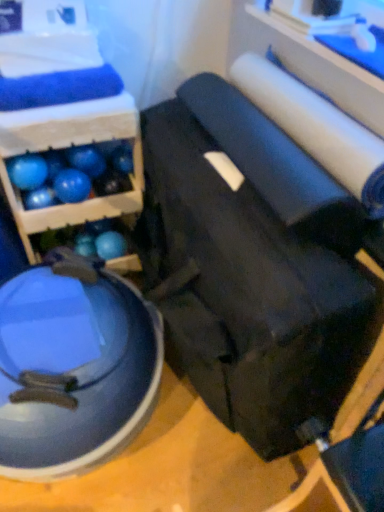
Question: Does blue matte wood shelf at upper left have a larger size compared to black leather swivel chair at center, positioned as the first swivel chair in right-to-left order?

Choices:
 (A) no
 (B) yes

Answer: (A)

Question: Does blue matte wood shelf at upper left have a lesser height compared to black leather swivel chair at center, acting as the 2th swivel chair starting from the left?

Choices:
 (A) no
 (B) yes

Answer: (B)

Question: Can you confirm if blue matte wood shelf at upper left is thinner than black leather swivel chair at center, positioned as the first swivel chair in right-to-left order?

Choices:
 (A) yes
 (B) no

Answer: (A)

Question: From a real-world perspective, is blue matte wood shelf at upper left located higher than black leather swivel chair at center, positioned as the first swivel chair in right-to-left order?

Choices:
 (A) no
 (B) yes

Answer: (B)

Question: Could you tell me if blue matte wood shelf at upper left is turned towards black leather swivel chair at center, positioned as the first swivel chair in right-to-left order?

Choices:
 (A) yes
 (B) no

Answer: (B)

Question: Is blue matte wood shelf at upper left next to black leather swivel chair at center, positioned as the first swivel chair in right-to-left order, and touching it?

Choices:
 (A) no
 (B) yes

Answer: (A)

Question: Is blue rubber ball at lower left, placed as the 4th ball when sorted from right to left, oriented away from blue rubber ball at center, acting as the 1th ball starting from the right?

Choices:
 (A) no
 (B) yes

Answer: (A)

Question: From a real-world perspective, is blue rubber ball at lower left, placed as the 4th ball when sorted from right to left, on blue rubber ball at center, which is the 5th ball in left-to-right order?

Choices:
 (A) yes
 (B) no

Answer: (B)

Question: Does blue rubber ball at lower left, placed as the 4th ball when sorted from right to left, have a larger size compared to blue rubber ball at center, acting as the 1th ball starting from the right?

Choices:
 (A) no
 (B) yes

Answer: (A)

Question: Could you tell me if blue rubber ball at lower left, the 2th ball when ordered from left to right, is turned towards blue rubber ball at center, acting as the 1th ball starting from the right?

Choices:
 (A) yes
 (B) no

Answer: (B)

Question: Is blue rubber ball at lower left, placed as the 4th ball when sorted from right to left, completely or partially outside of blue rubber ball at center, acting as the 1th ball starting from the right?

Choices:
 (A) yes
 (B) no

Answer: (A)

Question: Are blue rubber ball at lower left, the 2th ball when ordered from left to right, and blue rubber ball at center, acting as the 1th ball starting from the right, located far from each other?

Choices:
 (A) no
 (B) yes

Answer: (A)

Question: Is blue rubber ball at lower left, placed as the 4th ball when sorted from right to left, positioned behind glossy blue exercise ball at lower left, which appears as the 1th swivel chair when viewed from the left?

Choices:
 (A) no
 (B) yes

Answer: (B)